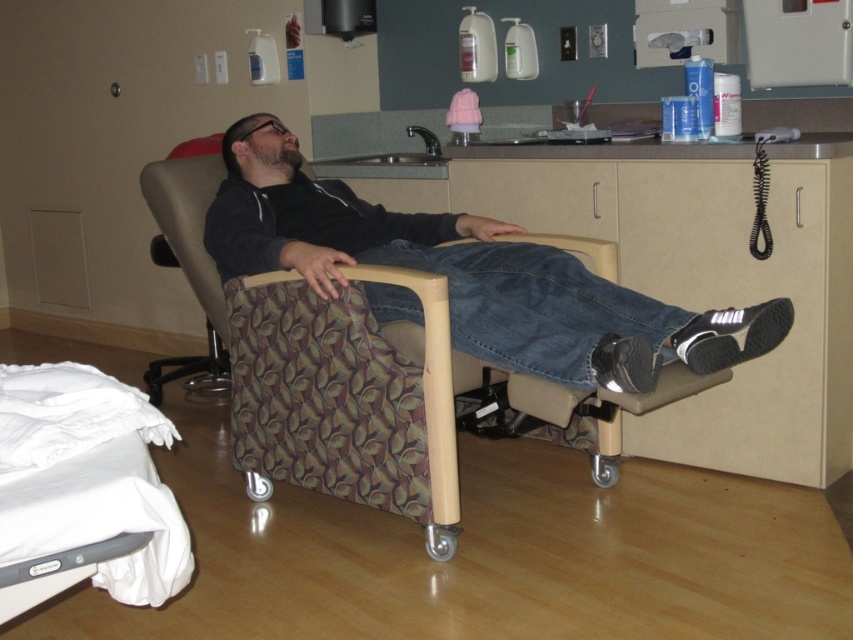
Which of these two, patterned fabric swivel chair at center or matte plastic drawer at center, stands shorter?

Standing shorter between the two is matte plastic drawer at center.

Can you confirm if patterned fabric swivel chair at center is shorter than matte plastic drawer at center?

No.

Which is in front, point (482, 362) or point (490, 182)?

Point (482, 362) is more forward.

Locate an element on the screen. patterned fabric swivel chair at center is located at coordinates (431, 390).

Does white fabric hospital bed at lower left appear under matte plastic drawer at center?

Yes.

Is white fabric hospital bed at lower left shorter than matte plastic drawer at center?

No.

I want to click on white fabric hospital bed at lower left, so click(x=85, y=483).

Based on the photo, can you confirm if matte black hoodie at center is positioned to the right of white fabric hospital bed at lower left?

Correct, you'll find matte black hoodie at center to the right of white fabric hospital bed at lower left.

Which is in front, point (378, 244) or point (86, 404)?

Positioned in front is point (86, 404).

Where is `matte black hoodie at center`? Image resolution: width=853 pixels, height=640 pixels. matte black hoodie at center is located at coordinates (467, 275).